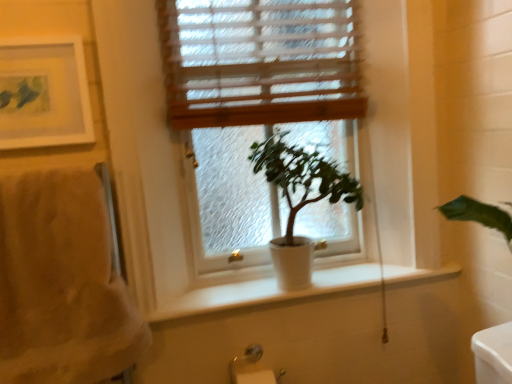
Question: From a real-world perspective, is green matte plant at center under silver metallic towel bar at lower left?

Choices:
 (A) no
 (B) yes

Answer: (A)

Question: Is green matte plant at center thinner than silver metallic towel bar at lower left?

Choices:
 (A) yes
 (B) no

Answer: (B)

Question: Considering the relative positions of green matte plant at center and silver metallic towel bar at lower left in the image provided, is green matte plant at center behind silver metallic towel bar at lower left?

Choices:
 (A) no
 (B) yes

Answer: (A)

Question: Considering the relative sizes of green matte plant at center and silver metallic towel bar at lower left in the image provided, is green matte plant at center wider than silver metallic towel bar at lower left?

Choices:
 (A) yes
 (B) no

Answer: (A)

Question: Can you confirm if green matte plant at center is positioned to the left of silver metallic towel bar at lower left?

Choices:
 (A) no
 (B) yes

Answer: (A)

Question: Does point (30, 49) appear closer or farther from the camera than point (198, 195)?

Choices:
 (A) closer
 (B) farther

Answer: (A)

Question: From a real-world perspective, is matte white picture frame at upper left physically located above or below white matte window at center?

Choices:
 (A) above
 (B) below

Answer: (A)

Question: Choose the correct answer: Is matte white picture frame at upper left inside white matte window at center or outside it?

Choices:
 (A) outside
 (B) inside

Answer: (A)

Question: From the image's perspective, is matte white picture frame at upper left positioned above or below white matte window at center?

Choices:
 (A) above
 (B) below

Answer: (A)

Question: Looking at the image, does wooden blinds at upper center seem bigger or smaller compared to matte white picture frame at upper left?

Choices:
 (A) small
 (B) big

Answer: (B)

Question: Is point (172, 26) positioned closer to the camera than point (65, 61)?

Choices:
 (A) closer
 (B) farther

Answer: (B)

Question: Is wooden blinds at upper center taller or shorter than matte white picture frame at upper left?

Choices:
 (A) short
 (B) tall

Answer: (B)

Question: From a real-world perspective, is wooden blinds at upper center above or below matte white picture frame at upper left?

Choices:
 (A) below
 (B) above

Answer: (B)

Question: From a real-world perspective, is green matte plant at center positioned above or below beige fluffy towel at left?

Choices:
 (A) above
 (B) below

Answer: (A)

Question: Considering the positions of green matte plant at center and beige fluffy towel at left in the image, is green matte plant at center bigger or smaller than beige fluffy towel at left?

Choices:
 (A) big
 (B) small

Answer: (B)